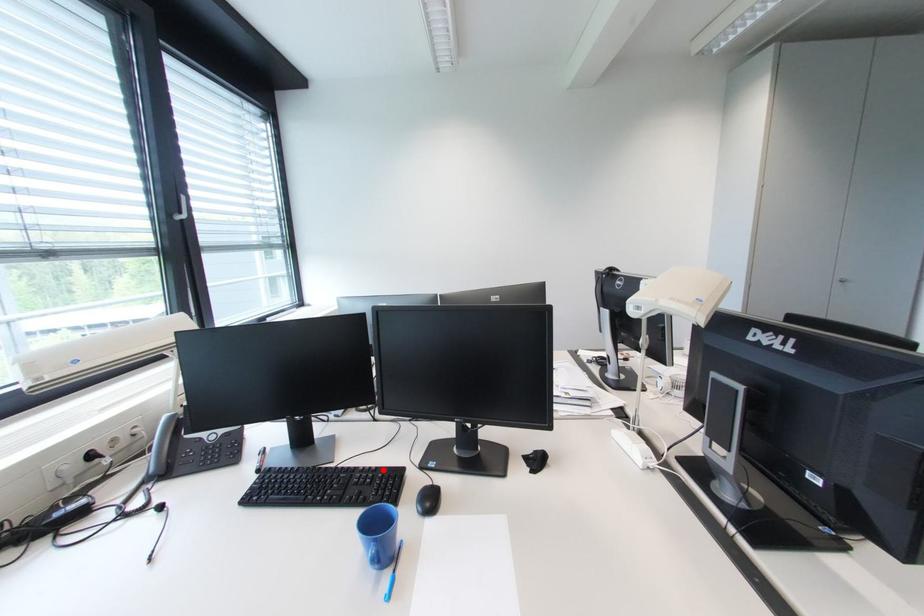
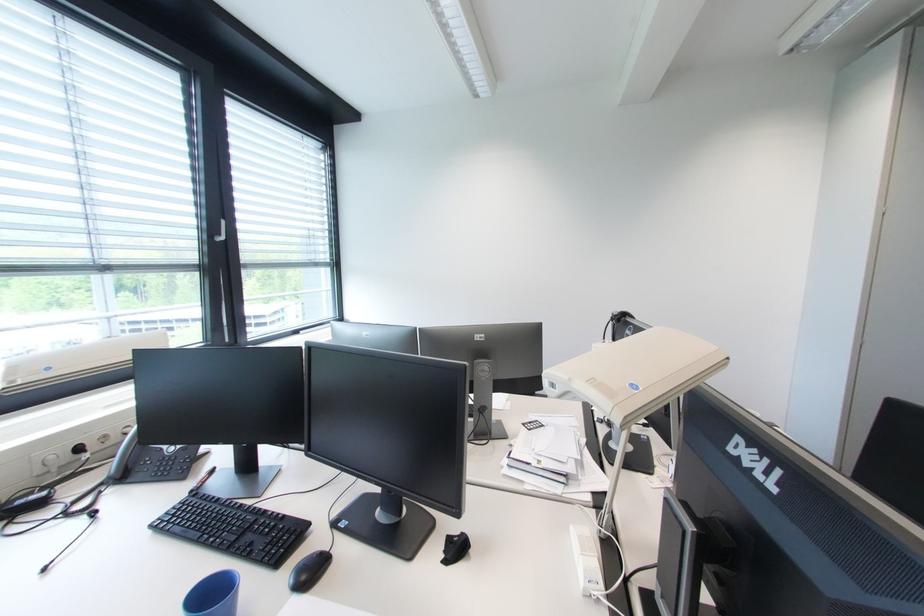
Where in the second image is the point corresponding to the highlighted location from the first image?

(290, 517)